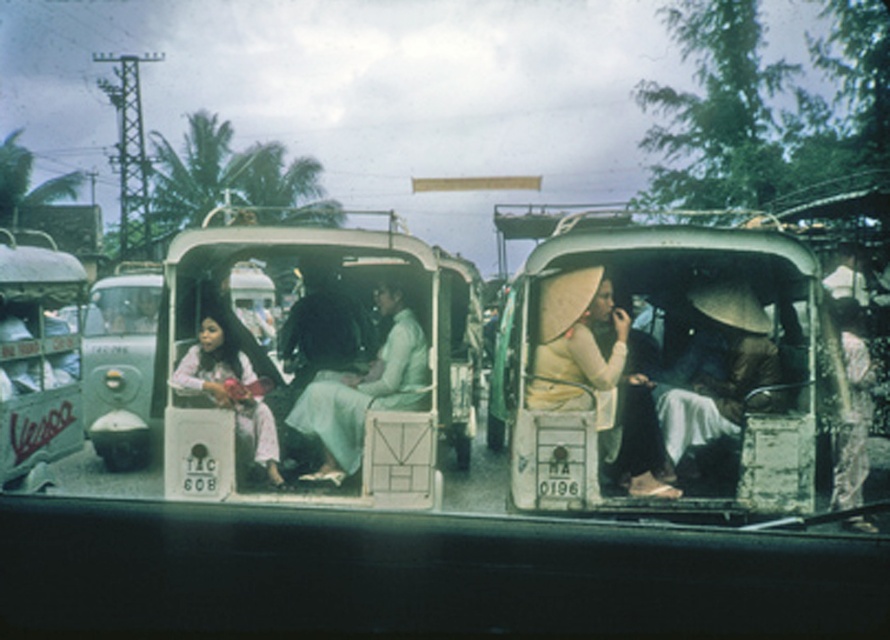
Can you confirm if yellow fabric hat at center is shorter than light pink fabric at left?

No, yellow fabric hat at center is not shorter than light pink fabric at left.

Is point (642, 451) closer to viewer compared to point (256, 401)?

Yes, it is in front of point (256, 401).

Identify the location of yellow fabric hat at center. (597, 376).

Who is lower down, yellow fabric hat at center or brushed metal vespa at left?

yellow fabric hat at center is lower down.

Between yellow fabric hat at center and brushed metal vespa at left, which one has less height?

yellow fabric hat at center is shorter.

Describe the element at coordinates (597, 376) in the screenshot. I see `yellow fabric hat at center` at that location.

Where is `yellow fabric hat at center`? yellow fabric hat at center is located at coordinates (597, 376).

Is brushed metal vespa at left to the left of light pink fabric at left from the viewer's perspective?

Indeed, brushed metal vespa at left is positioned on the left side of light pink fabric at left.

Describe the element at coordinates (37, 355) in the screenshot. The height and width of the screenshot is (640, 890). I see `brushed metal vespa at left` at that location.

You are a GUI agent. You are given a task and a screenshot of the screen. Output one action in this format:
    pyautogui.click(x=<x>, y=<y>)
    Task: Click on the brushed metal vespa at left
    The height and width of the screenshot is (640, 890).
    Given the screenshot: What is the action you would take?
    pyautogui.click(x=37, y=355)